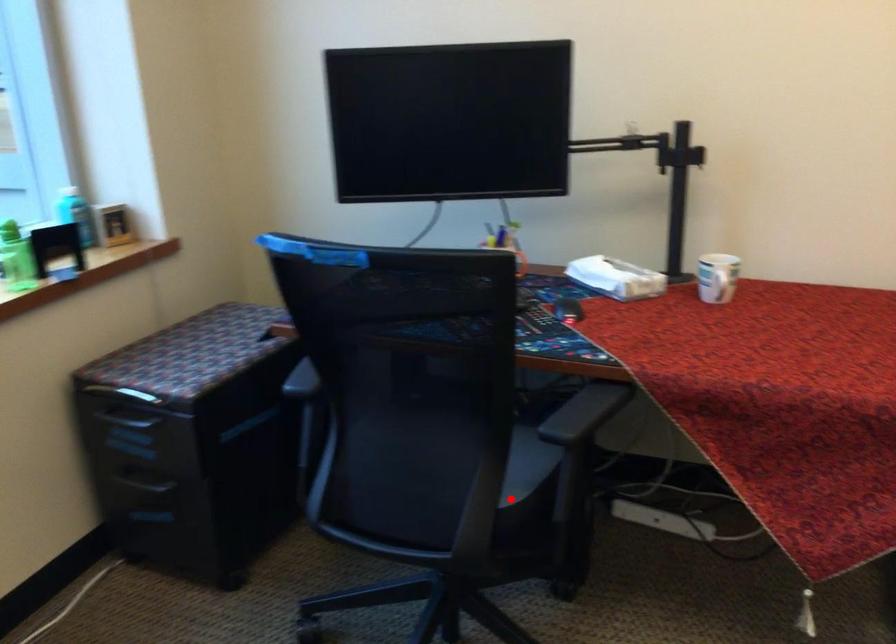
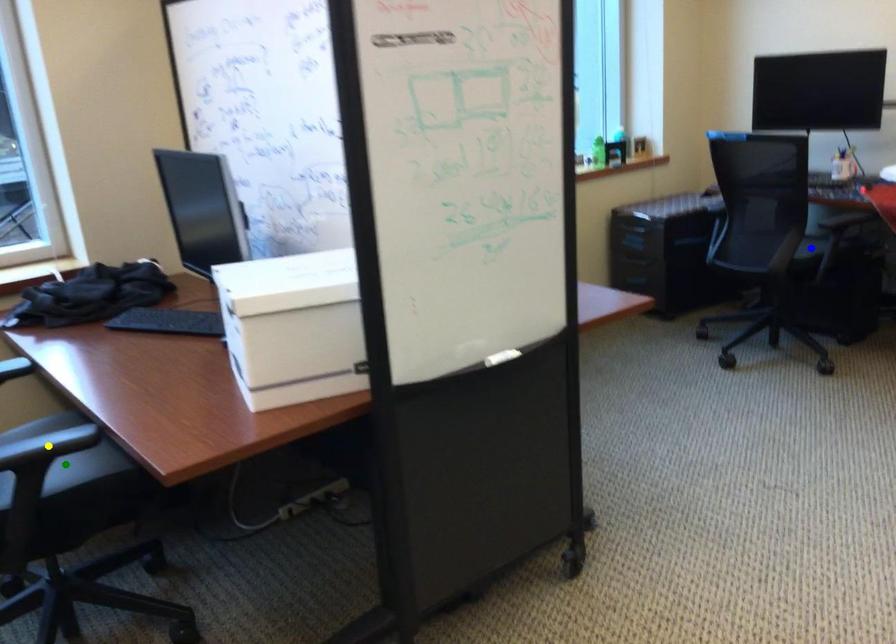
Question: I am providing you with two images of the same scene from different viewpoints. A red point is marked on the first image. You are given multiple points on the second image. Which mark in image 2 goes with the point in image 1?

Choices:
 (A) green point
 (B) blue point
 (C) yellow point

Answer: (B)